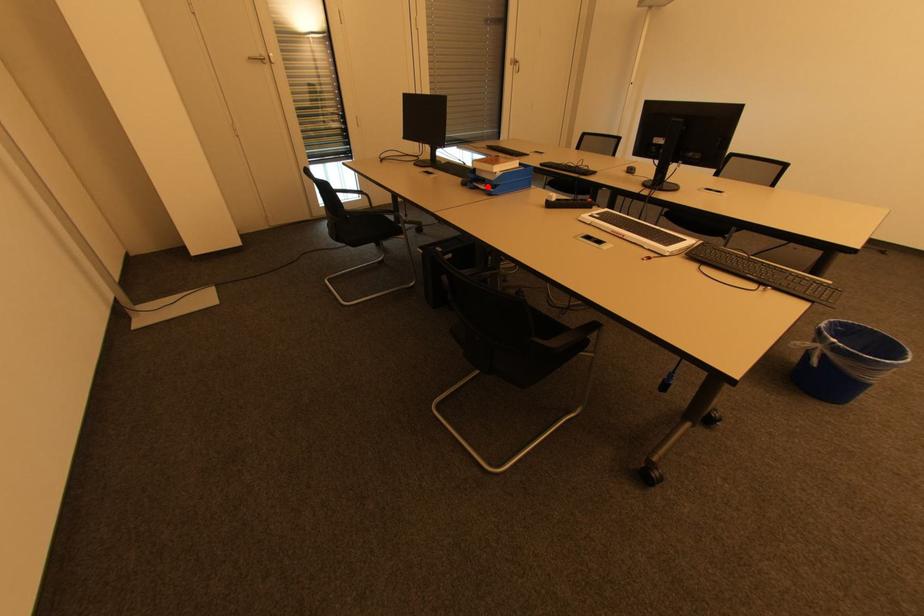
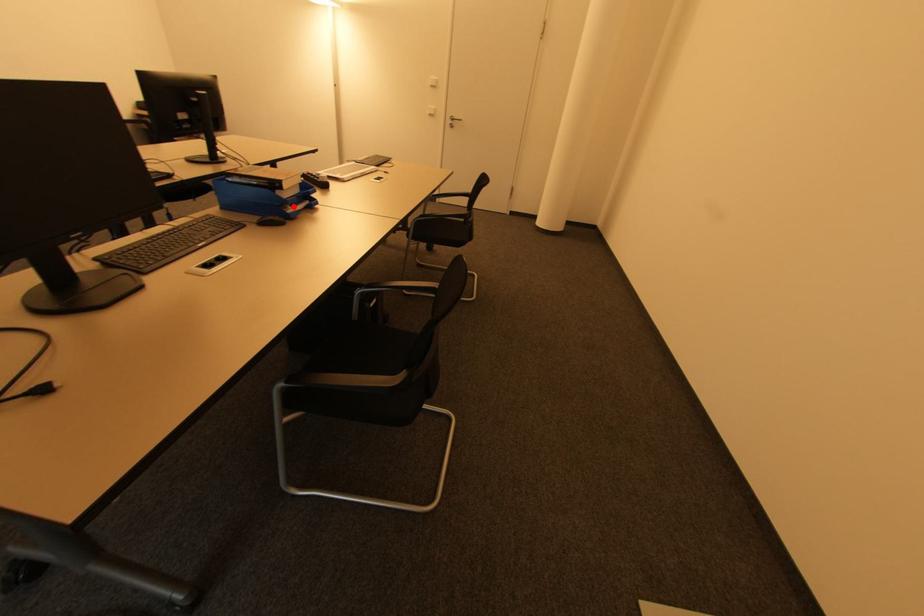
I am providing you with two images of the same scene from different viewpoints. A red point is marked on the first image and another point is marked on the second image. Do the highlighted points in image1 and image2 indicate the same real-world spot?

Yes